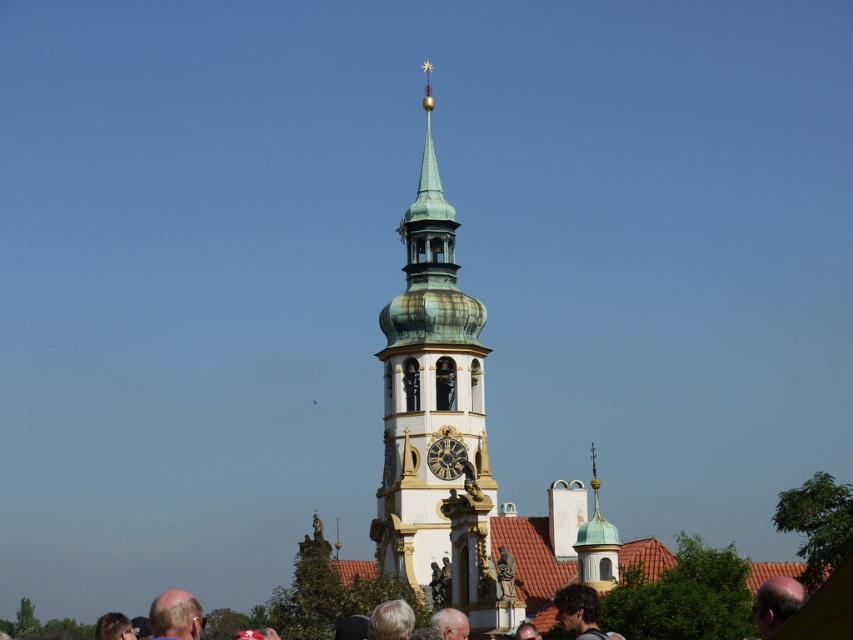
Question: Among these points, which one is nearest to the camera?

Choices:
 (A) (152, 616)
 (B) (454, 353)
 (C) (97, 637)

Answer: (A)

Question: Does light brown hair at lower left lie in front of gold metallic clock at center?

Choices:
 (A) no
 (B) yes

Answer: (B)

Question: Which point appears closest to the camera in this image?

Choices:
 (A) (387, 630)
 (B) (426, 326)
 (C) (782, 605)
 (D) (189, 612)

Answer: (C)

Question: Can you confirm if smooth bald head at center is thinner than blonde hair at lower left?

Choices:
 (A) no
 (B) yes

Answer: (B)

Question: Which object appears closest to the camera in this image?

Choices:
 (A) green copper clock tower at center
 (B) blonde hair at lower left
 (C) gray hair at lower center

Answer: (C)

Question: Is gray hair at lower center to the right of gold metallic clock at center from the viewer's perspective?

Choices:
 (A) no
 (B) yes

Answer: (A)